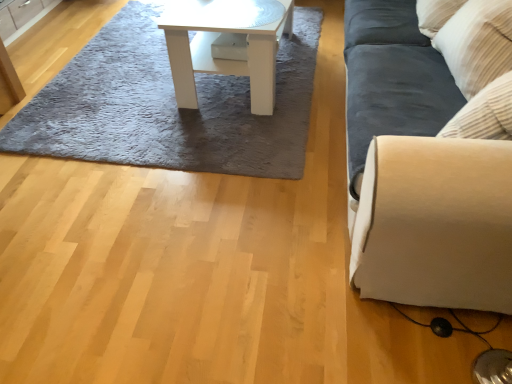
Question: Looking at their shapes, would you say gray shaggy rug at upper center is wider or thinner than suede-like beige couch at right?

Choices:
 (A) wide
 (B) thin

Answer: (A)

Question: From their relative heights in the image, would you say gray shaggy rug at upper center is taller or shorter than suede-like beige couch at right?

Choices:
 (A) tall
 (B) short

Answer: (B)

Question: Considering the real-world distances, which object is farthest from the suede-like beige couch at right?

Choices:
 (A) gray shaggy rug at upper center
 (B) white glossy table at center
 (C) matte wood cabinet at upper left

Answer: (C)

Question: Which object is the closest to the matte wood cabinet at upper left?

Choices:
 (A) white glossy table at center
 (B) suede-like beige couch at right
 (C) gray shaggy rug at upper center

Answer: (C)